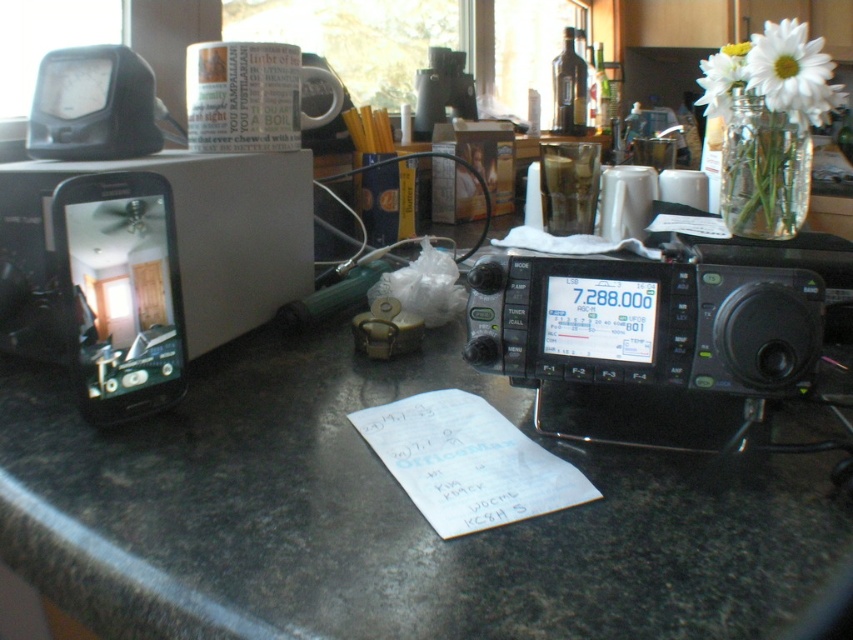
You are trying to place a 5.5 inch wide book between the black granite countertop at center and the black plastic radio at center. Will it fit?

The black granite countertop at center and black plastic radio at center are 5.23 inches apart. Since the book is 5.5 inches wide, it won not fit between them.

You are trying to locate the black granite countertop at center in the image. According to the coordinates provided, where is it positioned?

The black granite countertop at center is positioned at point (381, 516).